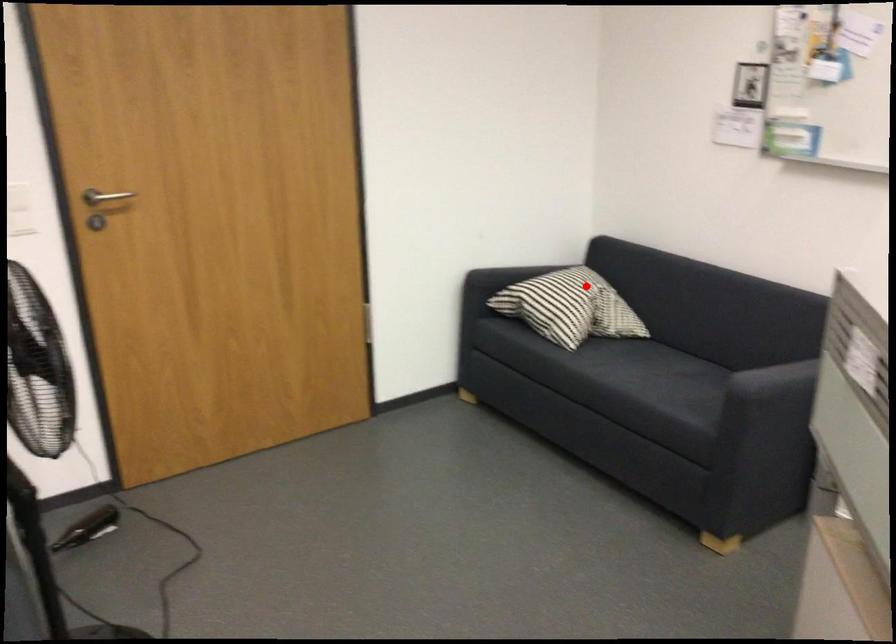
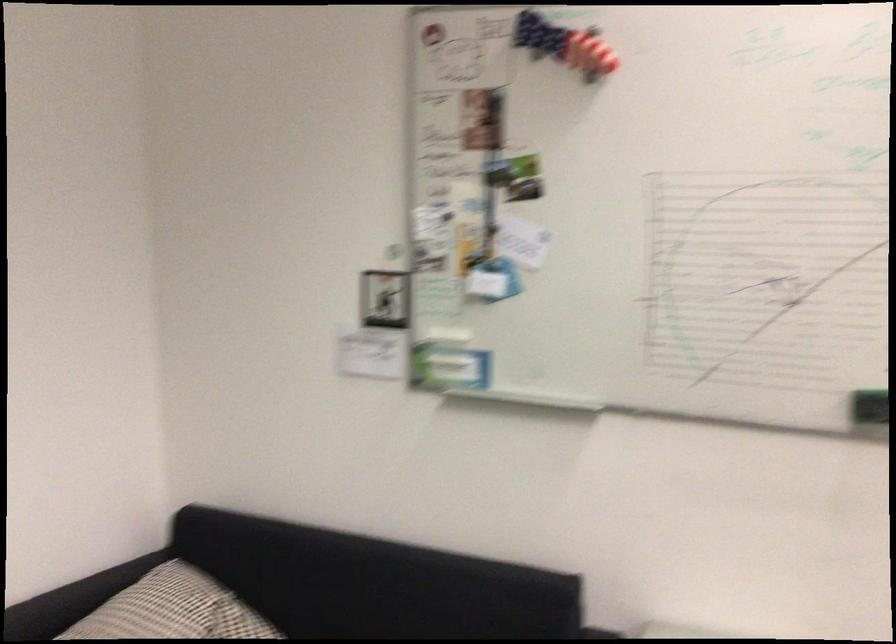
Find the pixel in the second image that matches the highlighted location in the first image.

(193, 612)